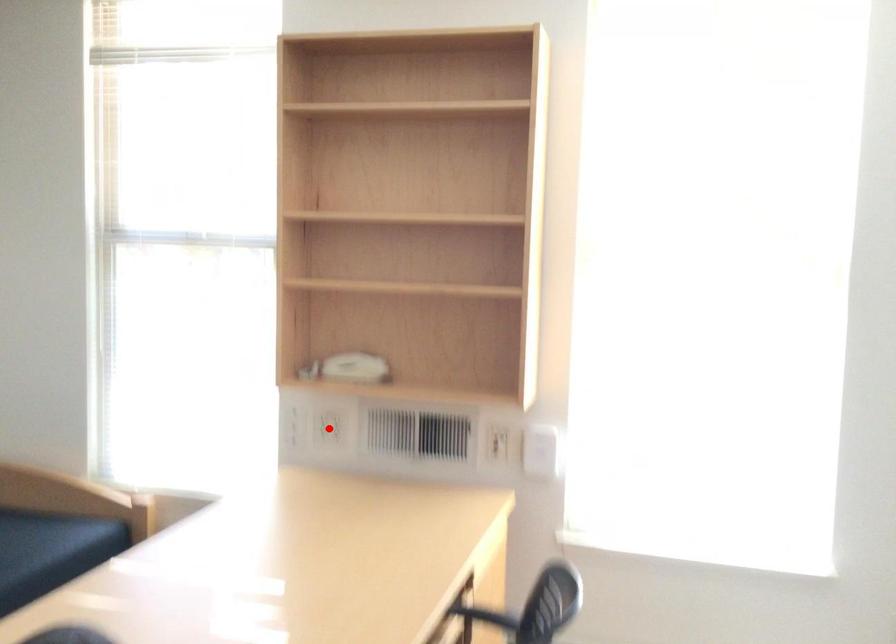
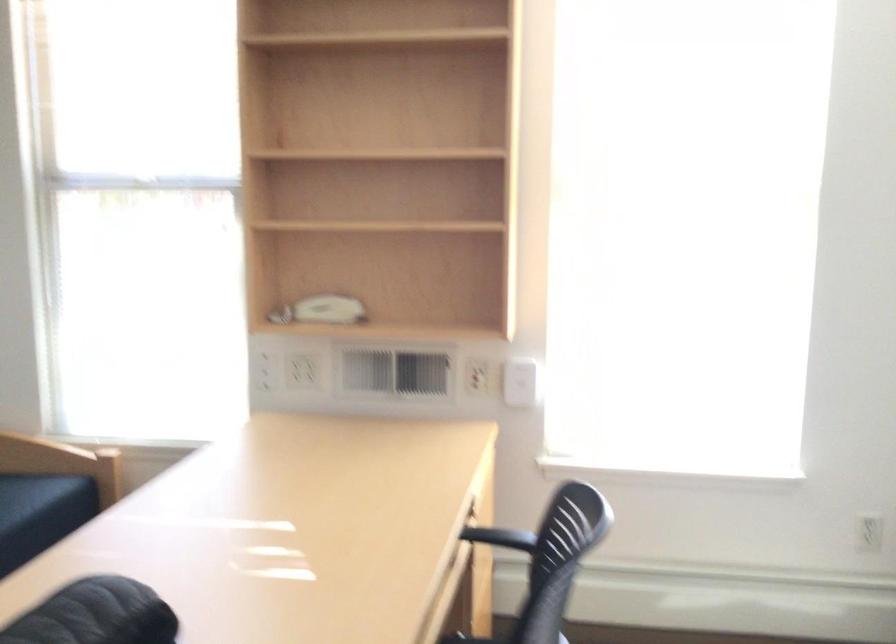
Where in the second image is the point corresponding to the highlighted location from the first image?

(303, 371)